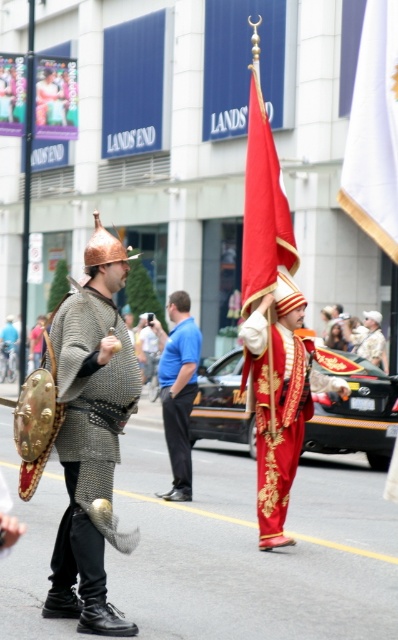
Question: Which point is closer to the camera?

Choices:
 (A) chainmail armor at center
 (B) white fabric flag at upper right
 (C) blue cotton shirt at center

Answer: (B)

Question: Does chainmail armor at center have a greater width compared to white fabric flag at upper right?

Choices:
 (A) no
 (B) yes

Answer: (B)

Question: Does silky red flag at center appear under blue cotton shirt at center?

Choices:
 (A) no
 (B) yes

Answer: (A)

Question: Which of the following is the closest to the observer?

Choices:
 (A) white fabric flag at upper right
 (B) silky red flag at center
 (C) chainmail armor at center

Answer: (A)

Question: Which of the following is the closest to the observer?

Choices:
 (A) (372, 160)
 (B) (251, 129)
 (C) (179, 387)

Answer: (A)

Question: Can you confirm if chainmail armor at center is positioned below blue cotton shirt at center?

Choices:
 (A) no
 (B) yes

Answer: (A)